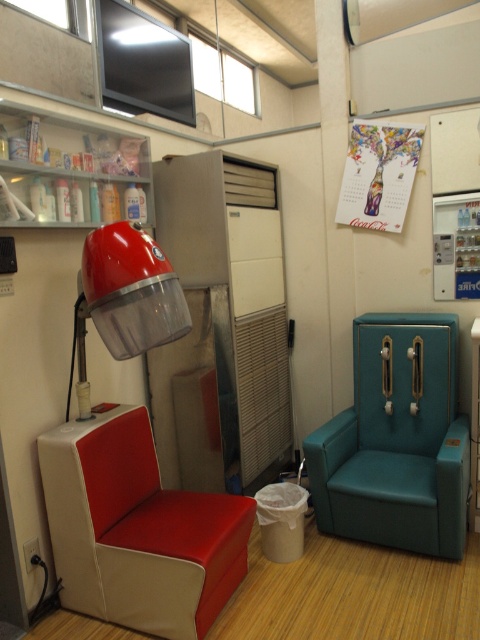
Is the position of teal leather chair at right more distant than that of matte red hairdryer at left?

Yes, teal leather chair at right is behind matte red hairdryer at left.

Does teal leather chair at right have a greater width compared to matte red hairdryer at left?

Yes, teal leather chair at right is wider than matte red hairdryer at left.

Who is more forward, [360,513] or [152,346]?

Positioned in front is point [152,346].

At what (x,y) coordinates should I click in order to perform the action: click on teal leather chair at right. Please return your answer as a coordinate pair (x, y). The height and width of the screenshot is (640, 480). Looking at the image, I should click on (396, 440).

Can you confirm if red leather armchair at left is wider than teal leather chair at right?

Yes.

What do you see at coordinates (137, 529) in the screenshot? The width and height of the screenshot is (480, 640). I see `red leather armchair at left` at bounding box center [137, 529].

The height and width of the screenshot is (640, 480). Identify the location of red leather armchair at left. (137, 529).

I want to click on red leather armchair at left, so click(137, 529).

You are a GUI agent. You are given a task and a screenshot of the screen. Output one action in this format:
    pyautogui.click(x=<x>, y=<y>)
    Task: Click on the red leather armchair at left
    This screenshot has height=640, width=480.
    Given the screenshot: What is the action you would take?
    pyautogui.click(x=137, y=529)

Which of these two, red leather armchair at left or matte red hairdryer at left, stands shorter?

matte red hairdryer at left

At what (x,y) coordinates should I click in order to perform the action: click on red leather armchair at left. Please return your answer as a coordinate pair (x, y). The image size is (480, 640). Looking at the image, I should click on (137, 529).